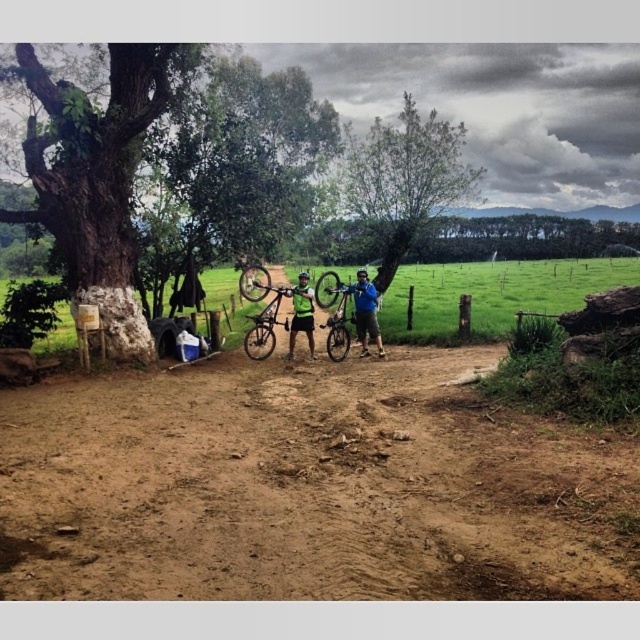
This screenshot has height=640, width=640. What do you see at coordinates (97, 177) in the screenshot? I see `green rough bark tree at left` at bounding box center [97, 177].

Which of these two, green rough bark tree at left or green leafy tree at upper center, stands shorter?

With less height is green rough bark tree at left.

Does point (81, 250) lie in front of point (420, 209)?

Yes, it is.

The image size is (640, 640). I want to click on green rough bark tree at left, so click(x=97, y=177).

Which of these two, green rough bark tree at left or shiny silver mountain bike at center, stands taller?

green rough bark tree at left

Measure the distance between green rough bark tree at left and camera.

The distance of green rough bark tree at left from camera is 29.09 feet.

The image size is (640, 640). Find the location of `green rough bark tree at left`. green rough bark tree at left is located at coordinates (97, 177).

Does brown sandy dirt at center have a greater width compared to green leafy tree at upper center?

No.

In the scene shown: Is brown sandy dirt at center smaller than green leafy tree at upper center?

Correct, brown sandy dirt at center occupies less space than green leafy tree at upper center.

This screenshot has width=640, height=640. Describe the element at coordinates (305, 486) in the screenshot. I see `brown sandy dirt at center` at that location.

The width and height of the screenshot is (640, 640). I want to click on brown sandy dirt at center, so click(x=305, y=486).